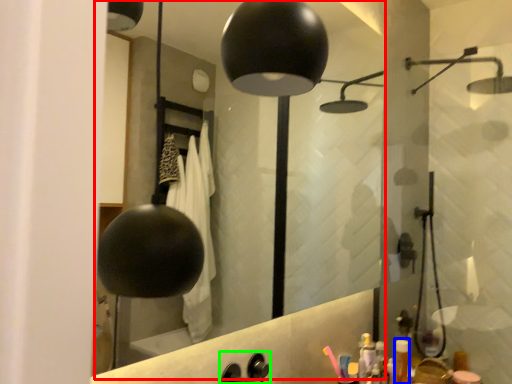
Question: Which object is positioned closest to mirror (highlighted by a red box)? Select from toiletry (highlighted by a blue box) and faucet (highlighted by a green box).

Choices:
 (A) toiletry
 (B) faucet

Answer: (A)